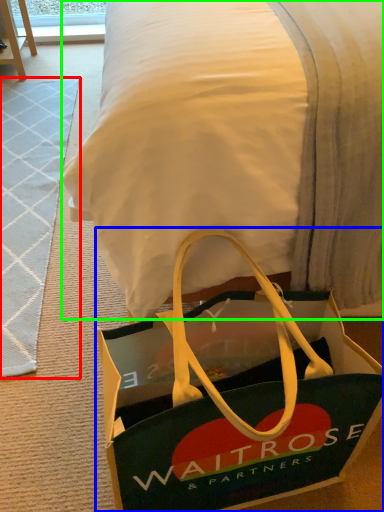
Question: Estimate the real-world distances between objects in this image. Which object is closer to doormat (highlighted by a red box), handbag (highlighted by a blue box) or blanket (highlighted by a green box)?

Choices:
 (A) handbag
 (B) blanket

Answer: (A)